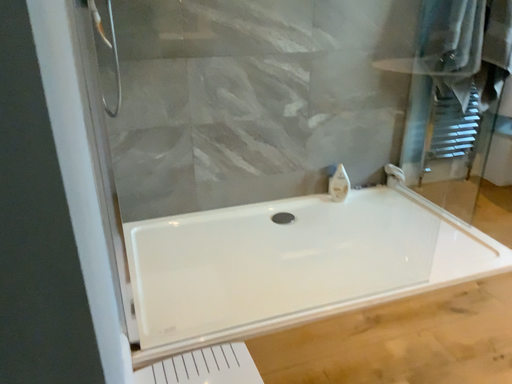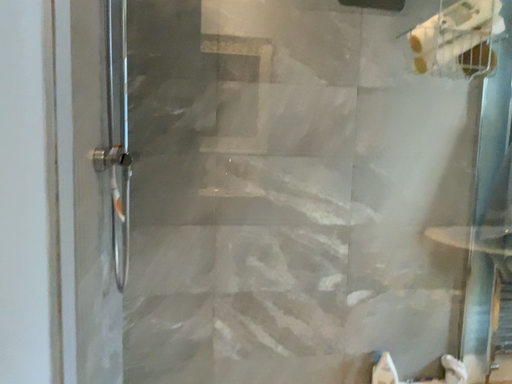
Question: Which way did the camera rotate in the video?

Choices:
 (A) rotated downward
 (B) rotated upward

Answer: (B)